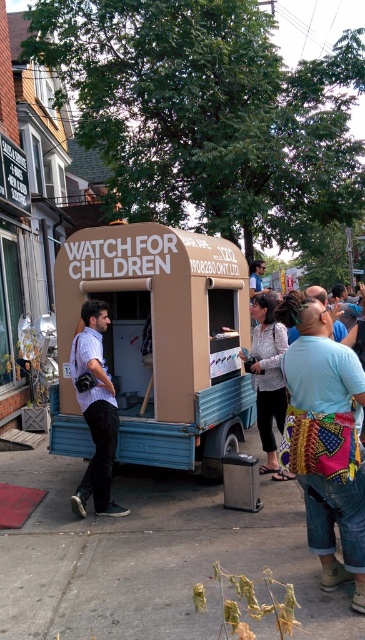
Question: Can you confirm if brown cardboard food truck at center is positioned below blue denim jeans at lower right?

Choices:
 (A) no
 (B) yes

Answer: (A)

Question: Which of the following is the farthest from the observer?

Choices:
 (A) brown cardboard food truck at center
 (B) light blue shirt at center
 (C) blue denim jeans at lower right

Answer: (B)

Question: Estimate the real-world distances between objects in this image. Which object is closer to the brown cardboard food truck at center?

Choices:
 (A) light blue shirt at center
 (B) concrete sidewalk at lower center
 (C) blue denim jeans at lower right

Answer: (B)

Question: Among these objects, which one is nearest to the camera?

Choices:
 (A) matte blue shirt at left
 (B) blue denim jeans at lower right
 (C) light blue shirt at center
 (D) concrete sidewalk at lower center

Answer: (D)

Question: In this image, where is concrete sidewalk at lower center located relative to blue denim jeans at lower right?

Choices:
 (A) below
 (B) above

Answer: (A)

Question: Can you confirm if brown cardboard food truck at center is positioned above matte blue shirt at left?

Choices:
 (A) no
 (B) yes

Answer: (B)